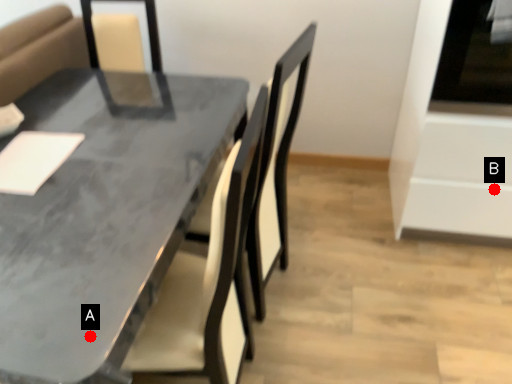
Question: Two points are circled on the image, labeled by A and B beside each circle. Among these points, which one is farthest from the camera?

Choices:
 (A) A is further
 (B) B is further

Answer: (B)